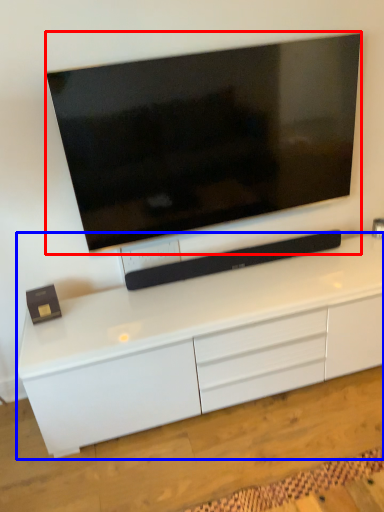
Question: Among these objects, which one is farthest to the camera, television (highlighted by a red box) or cabinetry (highlighted by a blue box)?

Choices:
 (A) television
 (B) cabinetry

Answer: (A)